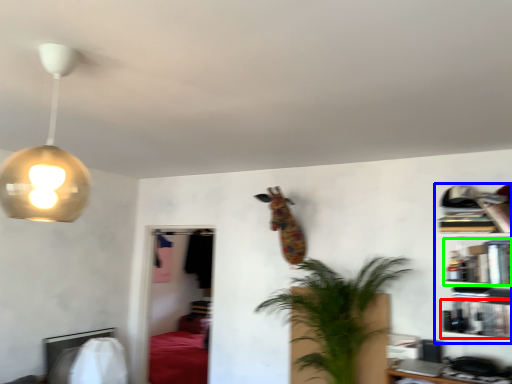
Question: Which object is positioned farthest from book (highlighted by a red box)? Select from shelf (highlighted by a blue box) and book (highlighted by a green box).

Choices:
 (A) shelf
 (B) book

Answer: (B)